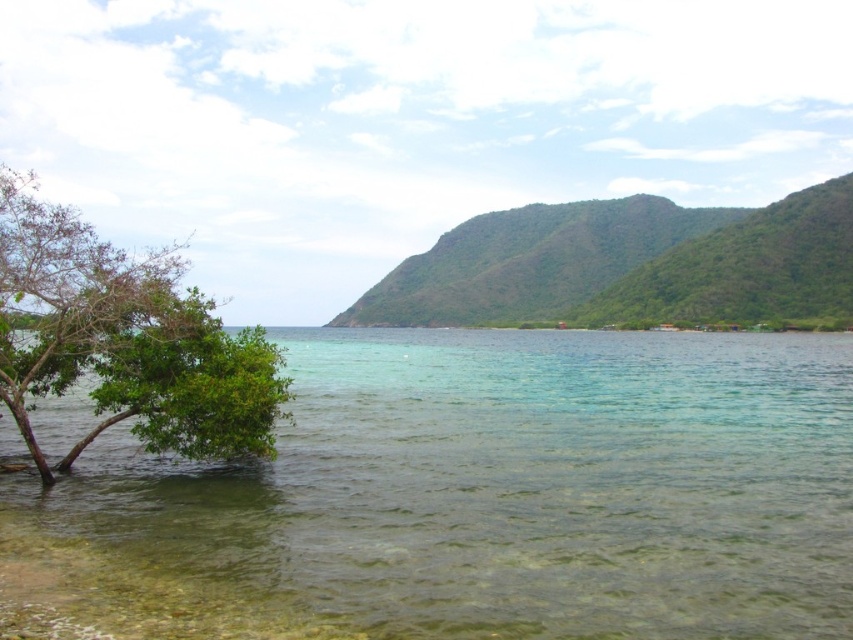
Question: Can you confirm if clear water at lower left is smaller than green leafy tree at left?

Choices:
 (A) yes
 (B) no

Answer: (B)

Question: Which object appears closest to the camera in this image?

Choices:
 (A) green leafy tree at left
 (B) clear water at lower left

Answer: (B)

Question: Is clear water at lower left behind green leafy tree at left?

Choices:
 (A) no
 (B) yes

Answer: (A)

Question: Which object appears farthest from the camera in this image?

Choices:
 (A) clear water at lower left
 (B) green leafy tree at left

Answer: (B)

Question: Does clear water at lower left appear under green leafy tree at left?

Choices:
 (A) no
 (B) yes

Answer: (B)

Question: Among these points, which one is nearest to the camera?

Choices:
 (A) (613, 609)
 (B) (47, 269)

Answer: (A)